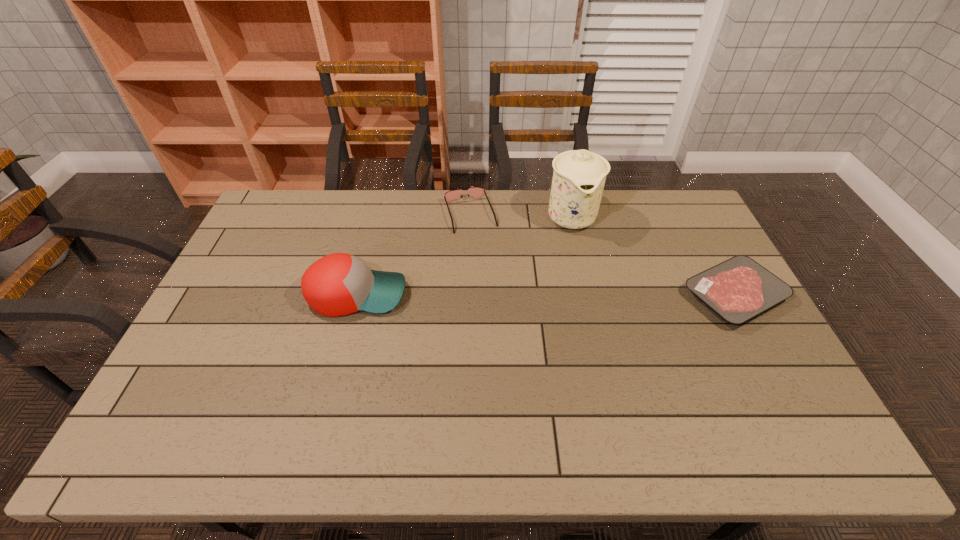
In the image, there is a desktop. Where is `vacant space at the near edge`? The image size is (960, 540). vacant space at the near edge is located at coordinates (532, 390).

Locate an element on the screen. This screenshot has width=960, height=540. vacant space at the left edge is located at coordinates (224, 299).

Where is `free region at the right edge`? The height and width of the screenshot is (540, 960). free region at the right edge is located at coordinates (669, 239).

Where is `vacant area at the far right corner of the desktop`? The height and width of the screenshot is (540, 960). vacant area at the far right corner of the desktop is located at coordinates (662, 216).

In order to click on free location at the near right corner of the desktop in this screenshot , I will do `click(741, 384)`.

The height and width of the screenshot is (540, 960). Identify the location of vacant space that's between the chinaware and the sunglasses. (520, 215).

The image size is (960, 540). I want to click on vacant area that lies between the shortest object and the second object from left to right, so click(x=602, y=255).

You are a GUI agent. You are given a task and a screenshot of the screen. Output one action in this format:
    pyautogui.click(x=<x>, y=<y>)
    Task: Click on the empty location between the shortest object and the baseball cap
    
    Given the screenshot: What is the action you would take?
    pyautogui.click(x=545, y=294)

This screenshot has width=960, height=540. I want to click on vacant area between the baseball cap and the tallest object, so click(464, 255).

Locate an element on the screen. vacant area that lies between the chinaware and the second shortest object is located at coordinates (520, 215).